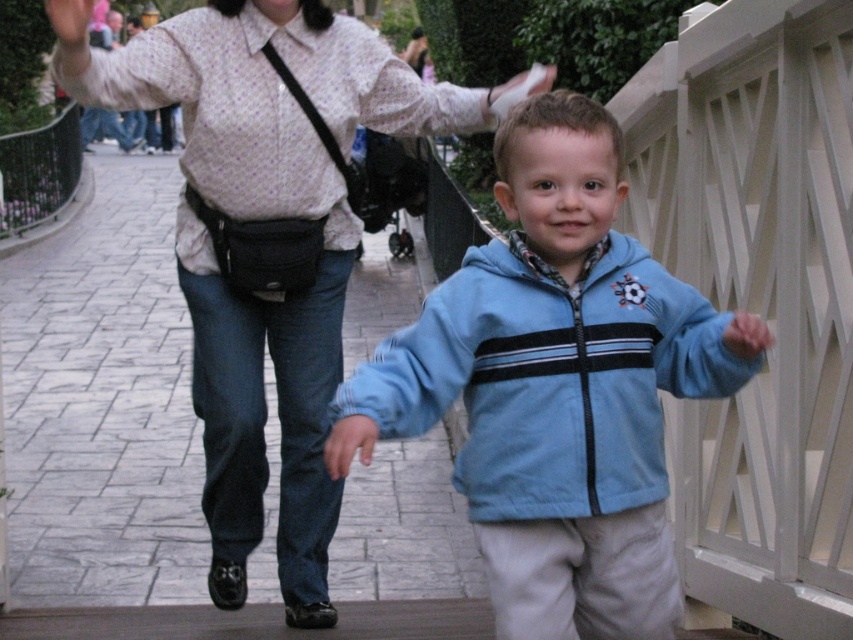
Is light blue fleece jacket at center to the right of matte white blouse at center from the viewer's perspective?

Yes, light blue fleece jacket at center is to the right of matte white blouse at center.

Between light blue fleece jacket at center and matte white blouse at center, which one appears on the right side from the viewer's perspective?

light blue fleece jacket at center is more to the right.

Is point (538, 321) in front of point (328, 291)?

Yes.

Locate an element on the screen. The width and height of the screenshot is (853, 640). light blue fleece jacket at center is located at coordinates (556, 387).